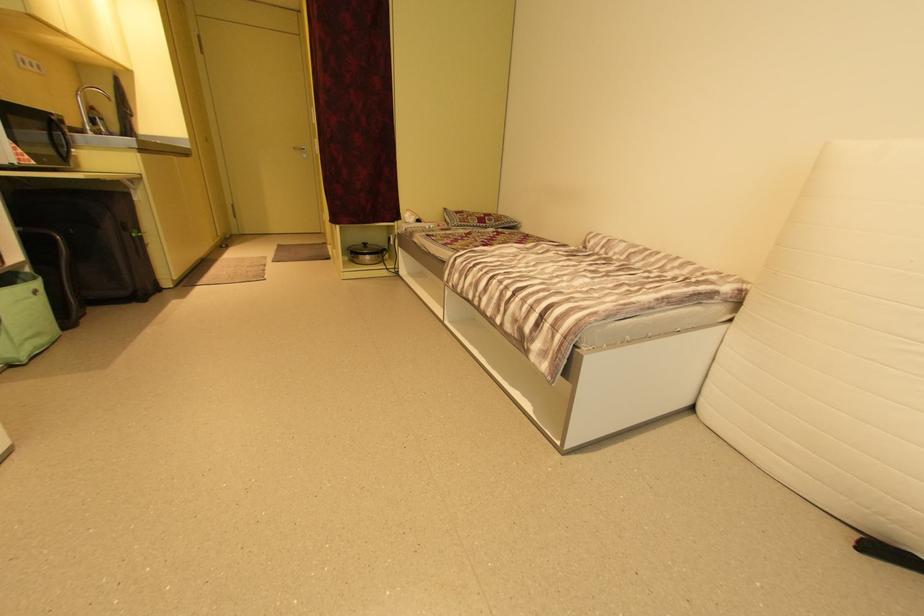
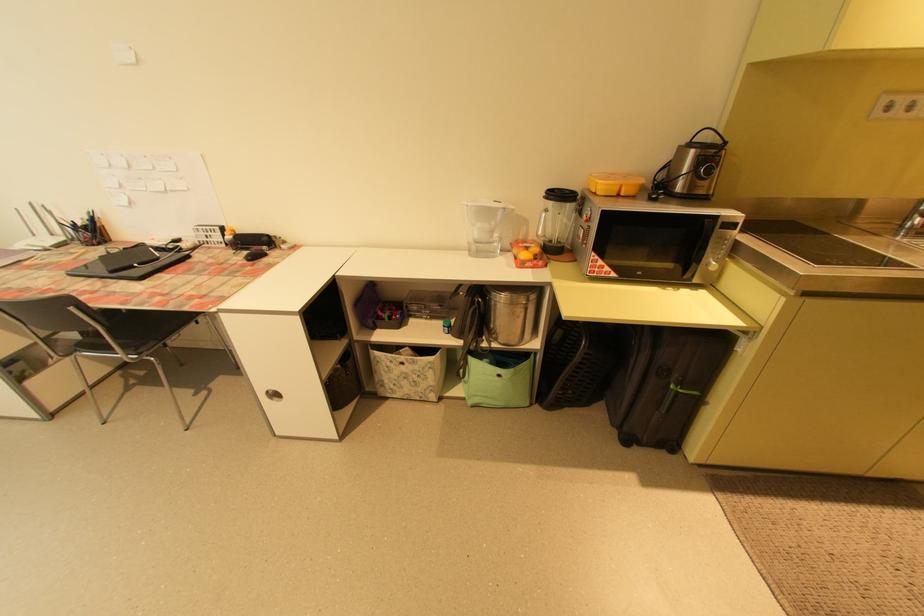
The point at (140, 236) is marked in the first image. Where is the corresponding point in the second image?

(678, 387)